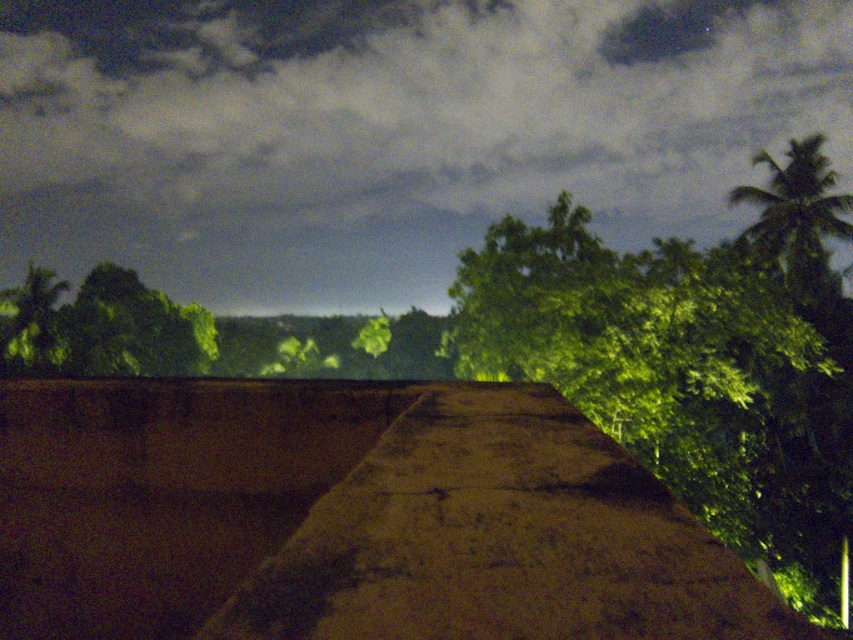
You are an astronomer looking at the image and want to locate the dark cloudy sky at upper center and the green leafy palm tree at upper right. Based on their positions, which object is closer to the left side of the image?

The dark cloudy sky at upper center is to the left of the green leafy palm tree at upper right, so the dark cloudy sky at upper center is closer to the left side of the image.

You are a drone operator trying to fly a drone between the dark cloudy sky at upper center and the green leafy palm tree at upper right. The drone has a maximum flight distance of 40 meters. Can the drone safely fly between them without exceeding its range?

The dark cloudy sky at upper center and green leafy palm tree at upper right are 40.73 meters apart from each other. Since the drone can only fly up to 40 meters, it cannot safely fly between them without exceeding its range.